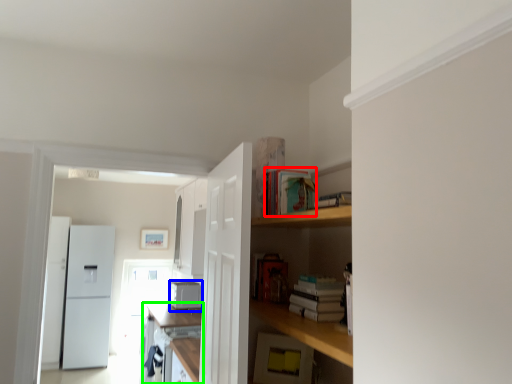
Question: Estimate the real-world distances between objects in this image. Which object is farther from book (highlighted by a red box), appliance (highlighted by a blue box) or cabinetry (highlighted by a green box)?

Choices:
 (A) appliance
 (B) cabinetry

Answer: (A)